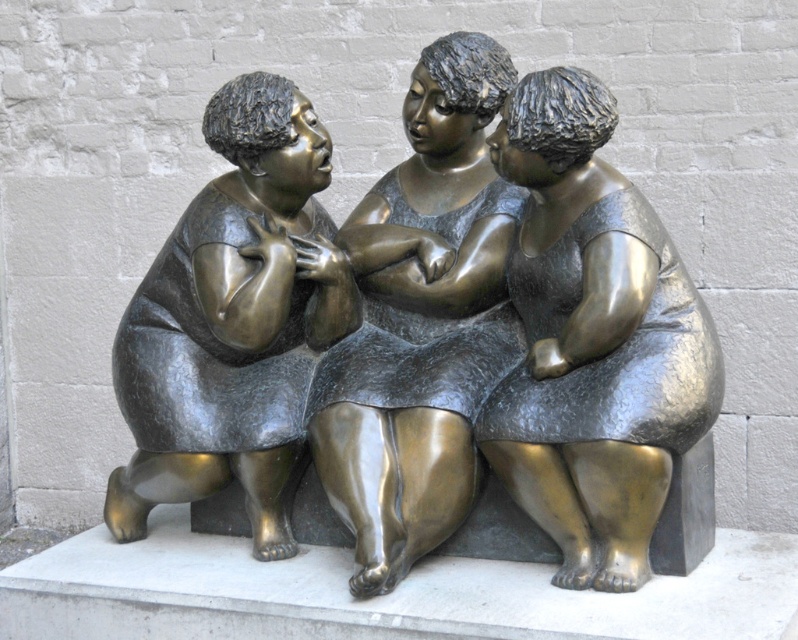
Question: Which of the following is the closest to the observer?

Choices:
 (A) bronze textured dress at center
 (B) bronze statue at center
 (C) bronze sculpture at center

Answer: (A)

Question: Among these points, which one is nearest to the camera?

Choices:
 (A) (364, 573)
 (B) (192, 408)

Answer: (A)

Question: Does bronze sculpture at center lie behind bronze statue at center?

Choices:
 (A) yes
 (B) no

Answer: (B)

Question: Which point is closer to the camera?

Choices:
 (A) [382, 566]
 (B) [652, 536]
 (C) [251, 474]

Answer: (A)

Question: Can you confirm if bronze sculpture at center is smaller than bronze textured dress at center?

Choices:
 (A) no
 (B) yes

Answer: (A)

Question: Is bronze textured dress at center in front of bronze statue at center?

Choices:
 (A) yes
 (B) no

Answer: (A)